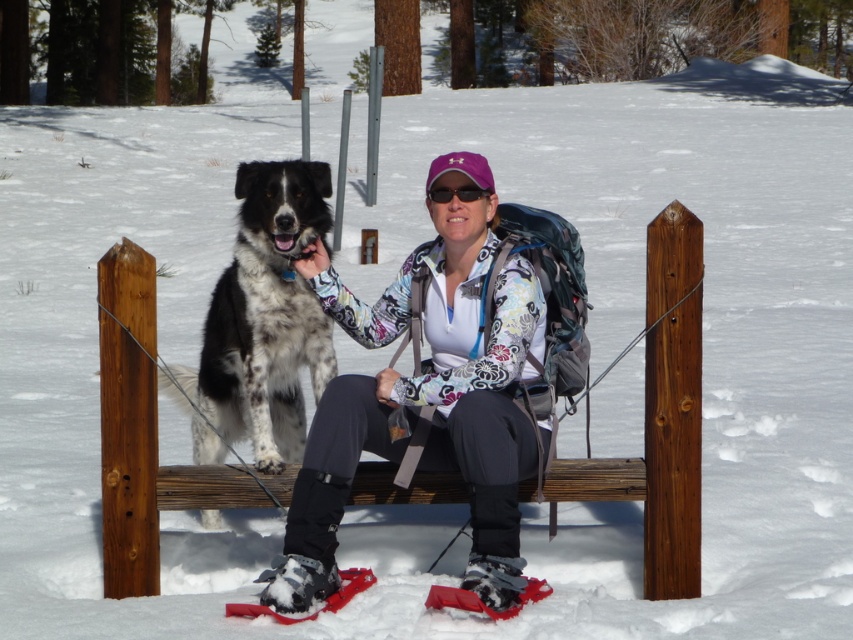
You are a photographer standing at the center of the image. You want to take a picture of the spotted fur dog at center. Where should you aim your camera to capture the dog in the frame?

The spotted fur dog at center is located at the 2D coordinates point (x=262, y=323), so you should aim your camera at that point to capture the dog in the frame.

You are a winter hiker who wants to place your gray fabric ski boot at lower center next to the wooden bench at center to rest. Is there enough space between them for you to comfortably sit on the bench?

The wooden bench at center and gray fabric ski boot at lower center are 35.99 inches apart. Since 35.99 inches is approximately 3 feet, there is enough space between them for you to comfortably sit on the bench.